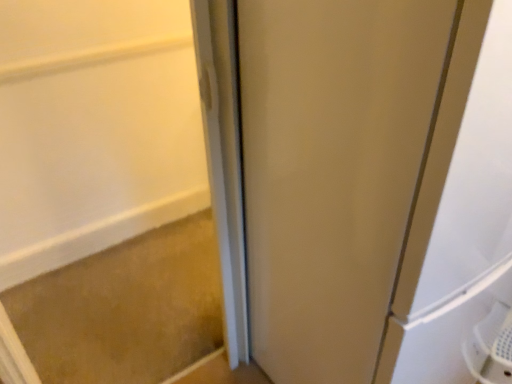
Describe the element at coordinates (331, 171) in the screenshot. I see `matte white door at center` at that location.

Identify the location of matte white door at center. (331, 171).

I want to click on matte white door at center, so click(x=331, y=171).